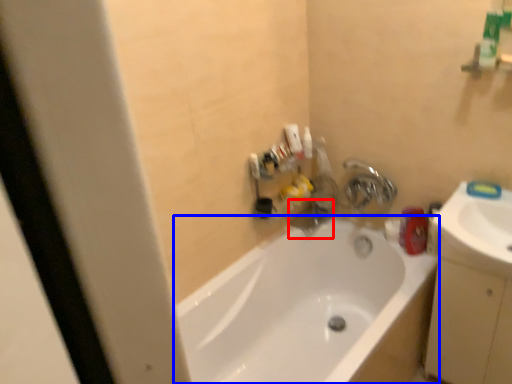
Question: Among these objects, which one is nearest to the camera, plumbing fixture (highlighted by a red box) or bathtub (highlighted by a blue box)?

Choices:
 (A) plumbing fixture
 (B) bathtub

Answer: (B)